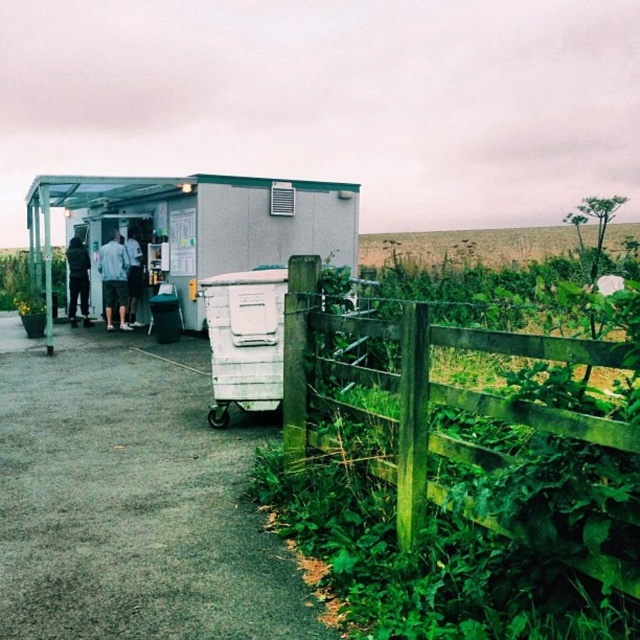
Who is higher up, green wooden fence at lower right or dark gray jacket at center?

dark gray jacket at center is higher up.

Is the position of green wooden fence at lower right less distant than that of dark gray jacket at center?

Yes.

Is point (410, 480) positioned in front of point (81, 244)?

That is True.

Where is `green wooden fence at lower right`? The image size is (640, 640). green wooden fence at lower right is located at coordinates (417, 392).

Who is positioned more to the right, white plastic trailer at lower right or white shirt at center?

white plastic trailer at lower right

Who is positioned more to the left, white plastic trailer at lower right or white shirt at center?

white shirt at center

I want to click on white plastic trailer at lower right, so click(x=244, y=339).

Does dark gray jacket at center have a smaller size compared to white shirt at center?

No.

Can you confirm if dark gray jacket at center is positioned below white shirt at center?

No, dark gray jacket at center is not below white shirt at center.

Does point (70, 244) come farther from viewer compared to point (140, 259)?

That is True.

You are a GUI agent. You are given a task and a screenshot of the screen. Output one action in this format:
    pyautogui.click(x=<x>, y=<y>)
    Task: Click on the dark gray jacket at center
    This screenshot has height=640, width=640.
    Given the screenshot: What is the action you would take?
    pyautogui.click(x=77, y=280)